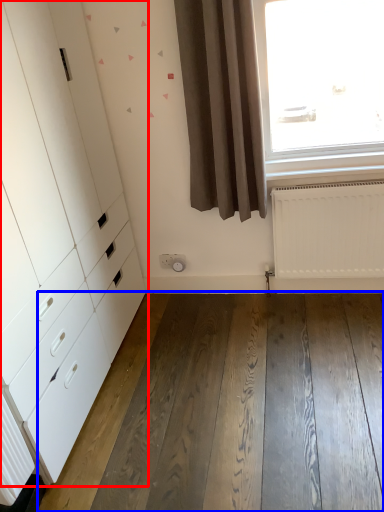
Question: Which of the following is the farthest to the observer, chest of drawers (highlighted by a red box) or hardwood (highlighted by a blue box)?

Choices:
 (A) chest of drawers
 (B) hardwood

Answer: (B)